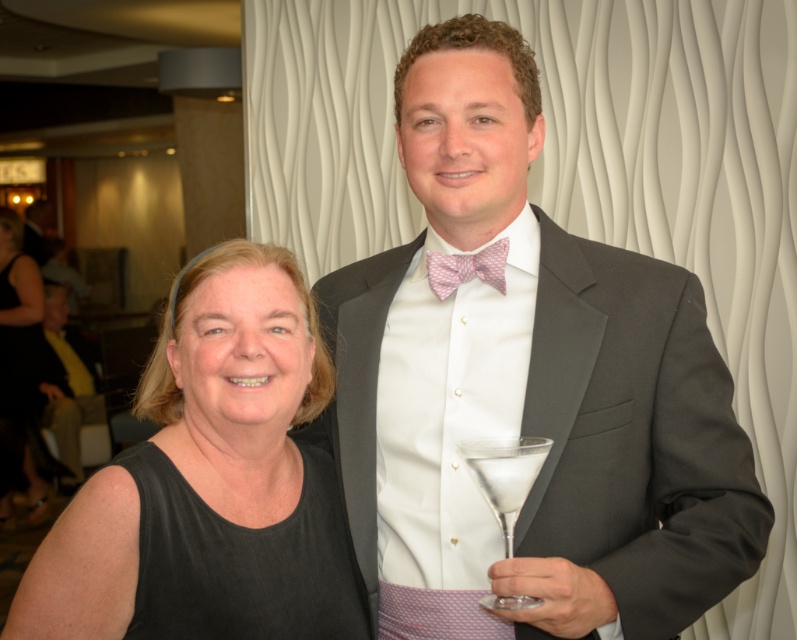
Question: Which object is the farthest from the clear glass martini glass at right?

Choices:
 (A) black fabric at left
 (B) matte gray suit at center
 (C) black dress at left

Answer: (C)

Question: Which point is closer to the camera taking this photo?

Choices:
 (A) (589, 387)
 (B) (497, 284)
 (C) (10, 445)
 (D) (313, 452)

Answer: (A)

Question: Does black fabric at left appear on the left side of black dress at left?

Choices:
 (A) no
 (B) yes

Answer: (A)

Question: Considering the relative positions of black fabric at left and black dress at left in the image provided, where is black fabric at left located with respect to black dress at left?

Choices:
 (A) right
 (B) left

Answer: (A)

Question: Estimate the real-world distances between objects in this image. Which object is farther from the matte gray suit at center?

Choices:
 (A) clear glass martini glass at right
 (B) black dress at left
 (C) black fabric at left

Answer: (B)

Question: From the image, what is the correct spatial relationship of matte gray suit at center in relation to pink checkered bow tie at center?

Choices:
 (A) above
 (B) below

Answer: (B)